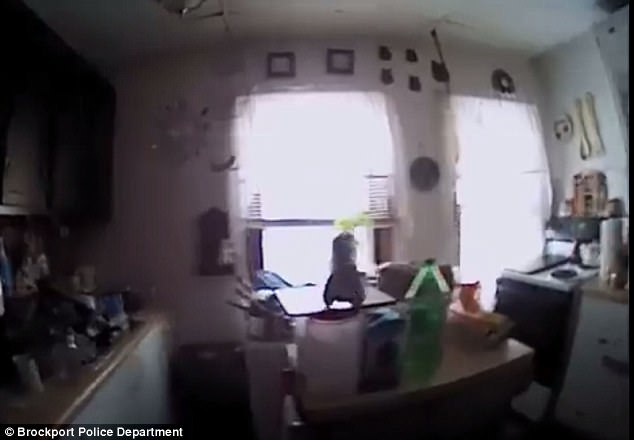
At what (x,y) coordinates should I click in order to perform the action: click on picture frames. Please return your answer as a coordinate pair (x, y). Looking at the image, I should click on (283, 64), (332, 64).